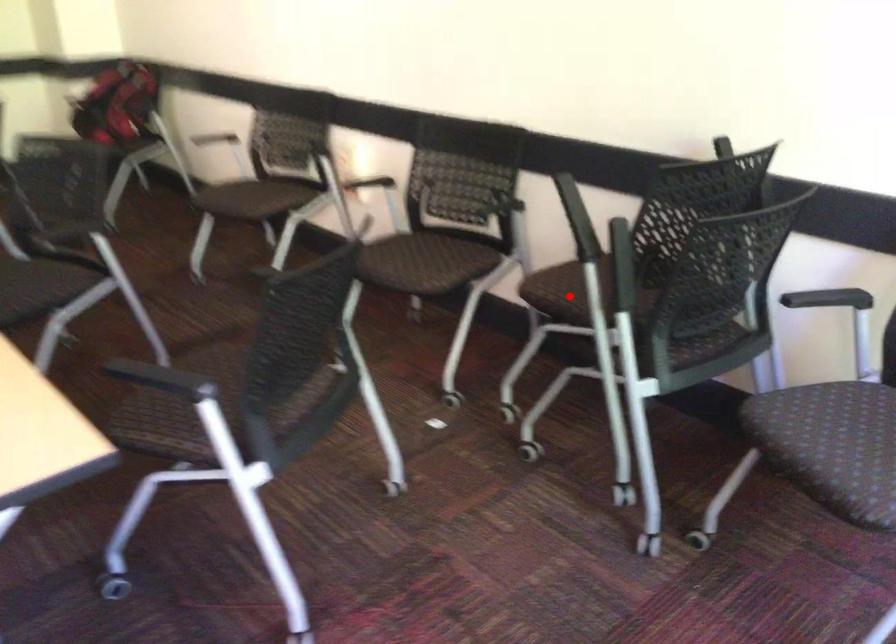
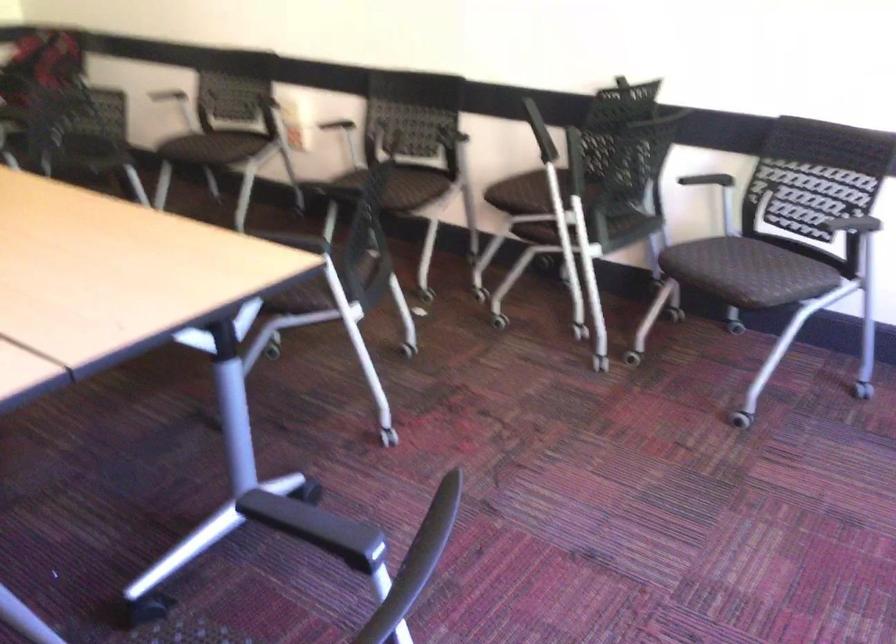
Question: I am providing you with two images of the same scene from different viewpoints. Given a red point in image1, look at the same physical point in image2. Is it:

Choices:
 (A) Closer to the viewpoint
 (B) Farther from the viewpoint

Answer: (B)